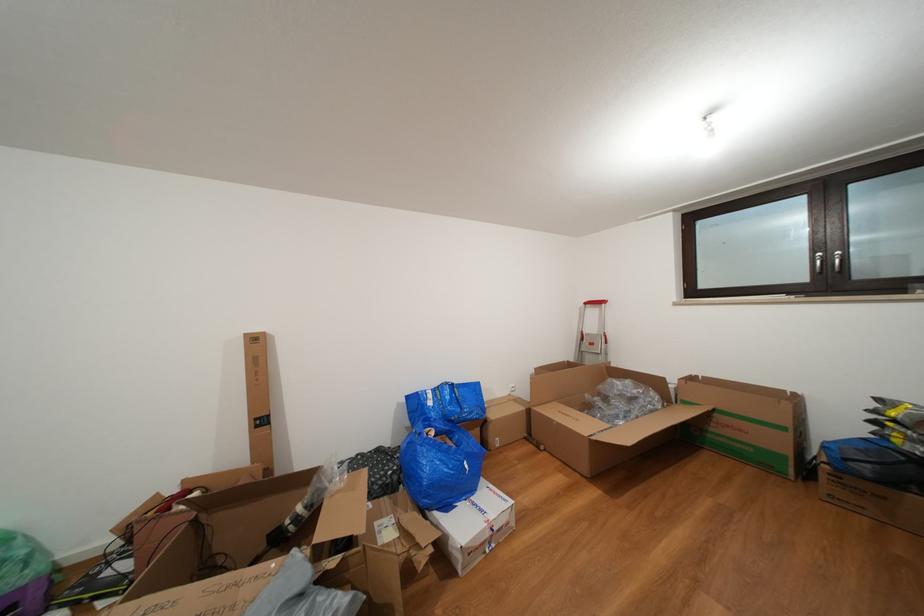
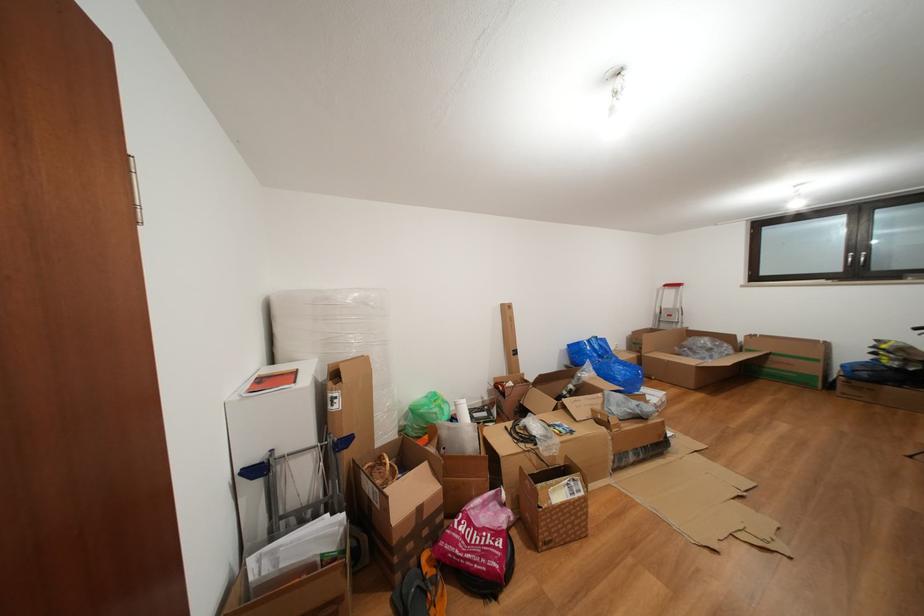
Question: I am providing you with two images of the same scene from different viewpoints. Please identify which objects are invisible in image2.

Choices:
 (A) orange flip-flop
 (B) wicker basket handle
 (C) blue plastic bag
 (D) none of these

Answer: (D)